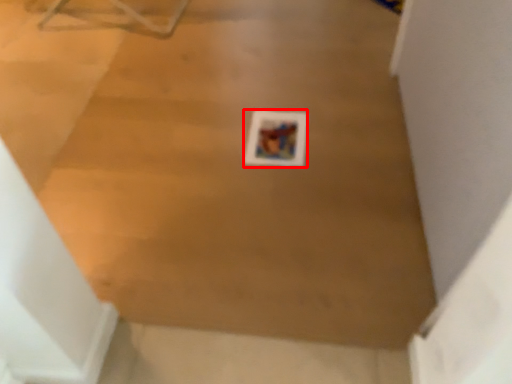
Question: From the image's perspective, where is print (annotated by the red box) located relative to plywood?

Choices:
 (A) above
 (B) below

Answer: (B)